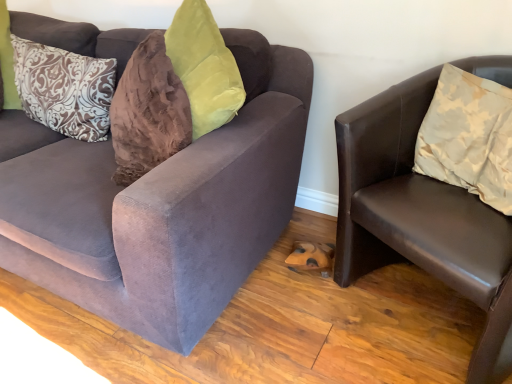
Question: Considering the relative positions of beige satin pillow at right, the 2th pillow when ordered from back to front, and brown patterned pillow at left, which appears as the first pillow when viewed from the back, in the image provided, is beige satin pillow at right, the 2th pillow when ordered from back to front, to the left of brown patterned pillow at left, which appears as the first pillow when viewed from the back, from the viewer's perspective?

Choices:
 (A) yes
 (B) no

Answer: (B)

Question: Is beige satin pillow at right, the 2th pillow when ordered from back to front, thinner than brown patterned pillow at left, the 2th pillow viewed from the right?

Choices:
 (A) no
 (B) yes

Answer: (A)

Question: From a real-world perspective, is beige satin pillow at right, the 2th pillow when ordered from back to front, positioned under brown patterned pillow at left, which ranks as the first pillow in left-to-right order, based on gravity?

Choices:
 (A) no
 (B) yes

Answer: (A)

Question: Are beige satin pillow at right, the 1th pillow from the front, and brown patterned pillow at left, which ranks as the 2th pillow in front-to-back order, making contact?

Choices:
 (A) no
 (B) yes

Answer: (A)

Question: Is the depth of beige satin pillow at right, the 2th pillow when ordered from back to front, less than that of brown patterned pillow at left, which appears as the first pillow when viewed from the back?

Choices:
 (A) yes
 (B) no

Answer: (A)

Question: Does beige satin pillow at right, the first pillow when ordered from right to left, have a greater height compared to brown patterned pillow at left, the 2th pillow viewed from the right?

Choices:
 (A) yes
 (B) no

Answer: (B)

Question: Does velvet brown couch at left, the 2th studio couch viewed from the right, have a lesser height compared to brown leather chair at right, which is the second studio couch from left to right?

Choices:
 (A) yes
 (B) no

Answer: (B)

Question: From a real-world perspective, is velvet brown couch at left, arranged as the 1th studio couch when viewed from the left, on brown leather chair at right, the first studio couch viewed from the right?

Choices:
 (A) yes
 (B) no

Answer: (A)

Question: Would you consider velvet brown couch at left, the 2th studio couch viewed from the right, to be distant from brown leather chair at right, the first studio couch viewed from the right?

Choices:
 (A) no
 (B) yes

Answer: (A)

Question: From a real-world perspective, is velvet brown couch at left, the 2th studio couch viewed from the right, physically below brown leather chair at right, the first studio couch viewed from the right?

Choices:
 (A) yes
 (B) no

Answer: (B)

Question: Is velvet brown couch at left, the 2th studio couch viewed from the right, surrounding brown leather chair at right, which is the second studio couch from left to right?

Choices:
 (A) no
 (B) yes

Answer: (A)

Question: Does velvet brown couch at left, arranged as the 1th studio couch when viewed from the left, have a greater width compared to brown leather chair at right, the first studio couch viewed from the right?

Choices:
 (A) yes
 (B) no

Answer: (A)